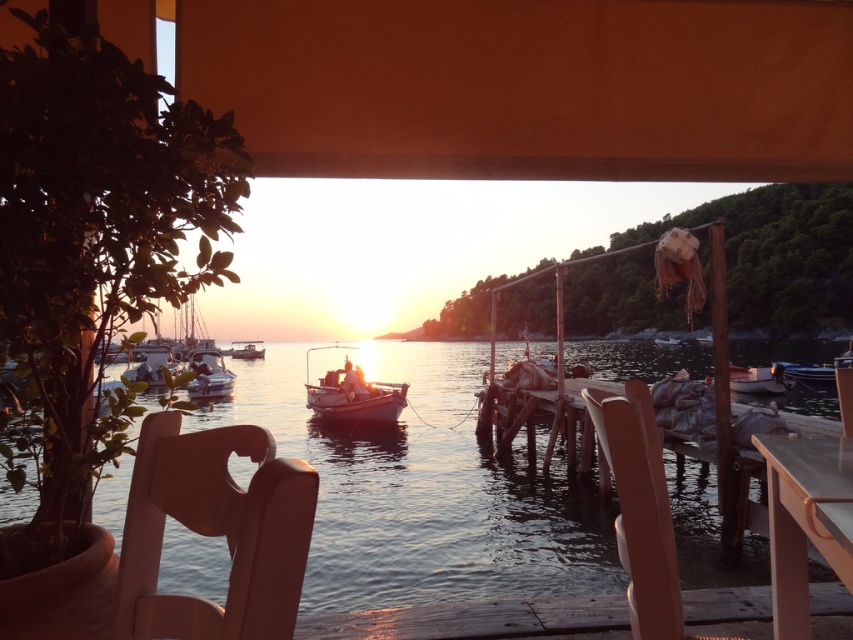
You are standing on the dock and want to reach a point that is exactly 1.2 meters away from you. Is the point at coordinates point (635, 582) within reach?

The point (635, 582) is 1.19 meters away from the viewer, so yes, it is within reach as it is slightly closer than the desired 1.2 meters.

You are standing on the wooden dock and want to take a photo of the sunset. The orange fabric canopy at upper center is blocking your view. Can you move the translucent water at center to get a clear shot?

The translucent water at center is behind orange fabric canopy at upper center, so moving the water isn not possible since it is a natural element and cannot be relocated. You would need to reposition yourself or remove the canopy to get an unobstructed view.